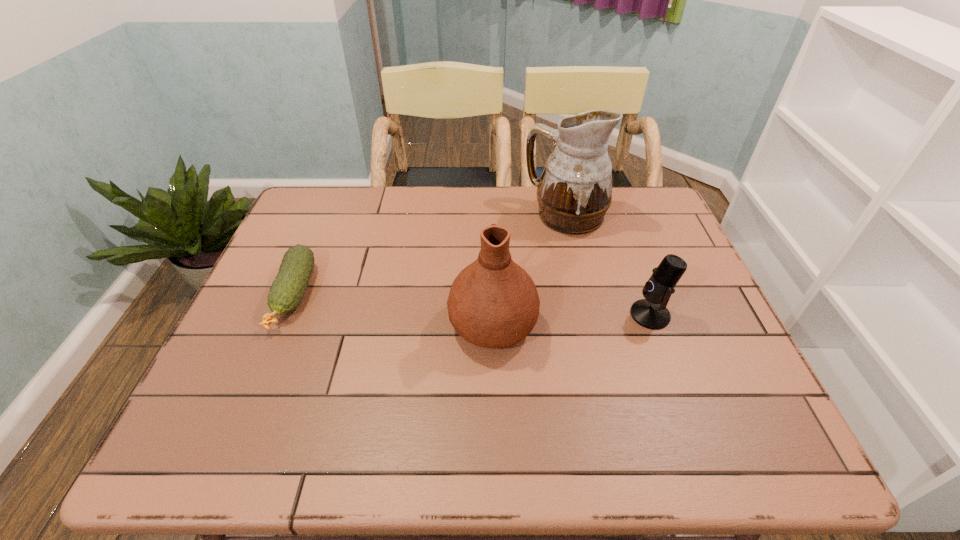
Where is `the right pitcher`? The image size is (960, 540). the right pitcher is located at coordinates click(x=574, y=192).

Find the location of a particular element. This screenshot has width=960, height=540. the farthest object is located at coordinates (574, 192).

You are a GUI agent. You are given a task and a screenshot of the screen. Output one action in this format:
    pyautogui.click(x=<x>, y=<y>)
    Task: Click on the second tallest object
    
    Given the screenshot: What is the action you would take?
    pyautogui.click(x=493, y=303)

In order to click on the left pitcher in this screenshot , I will do `click(493, 303)`.

In order to click on the third tallest object in this screenshot , I will do `click(651, 312)`.

You are a GUI agent. You are given a task and a screenshot of the screen. Output one action in this format:
    pyautogui.click(x=<x>, y=<y>)
    Task: Click on the leftmost object
    Image resolution: width=960 pixels, height=540 pixels.
    Given the screenshot: What is the action you would take?
    click(287, 290)

In order to click on the shortest object in this screenshot , I will do `click(287, 290)`.

The height and width of the screenshot is (540, 960). What are the coordinates of `free space located 0.110m from the spout of the farthest object` in the screenshot? It's located at (489, 215).

This screenshot has width=960, height=540. In order to click on vacant space situated from the spout of the farthest object in this screenshot , I will do `click(437, 215)`.

The image size is (960, 540). I want to click on free region located from the spout of the farthest object, so tap(459, 215).